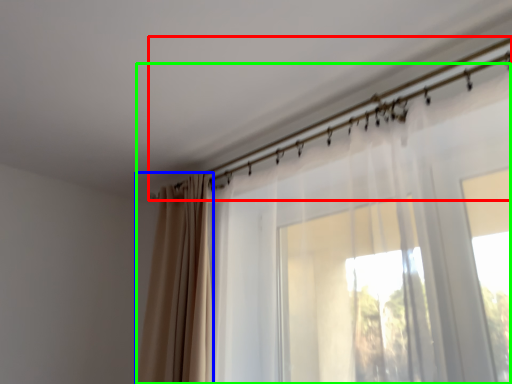
Question: Based on their relative distances, which object is nearer to clothesline (highlighted by a red box)? Choose from curtain (highlighted by a blue box) and curtain (highlighted by a green box).

Choices:
 (A) curtain
 (B) curtain

Answer: (B)